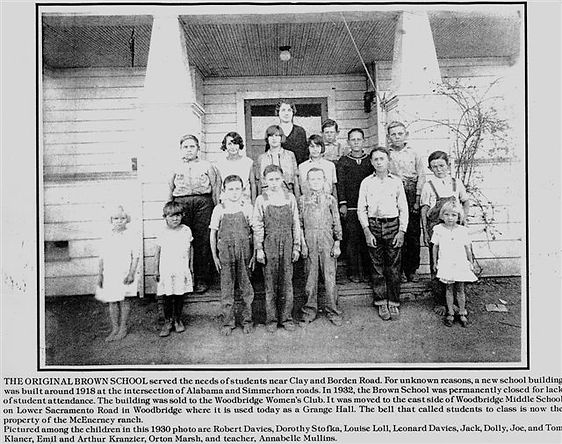
The image size is (562, 444). In order to click on light in this screenshot , I will do `click(285, 55)`.